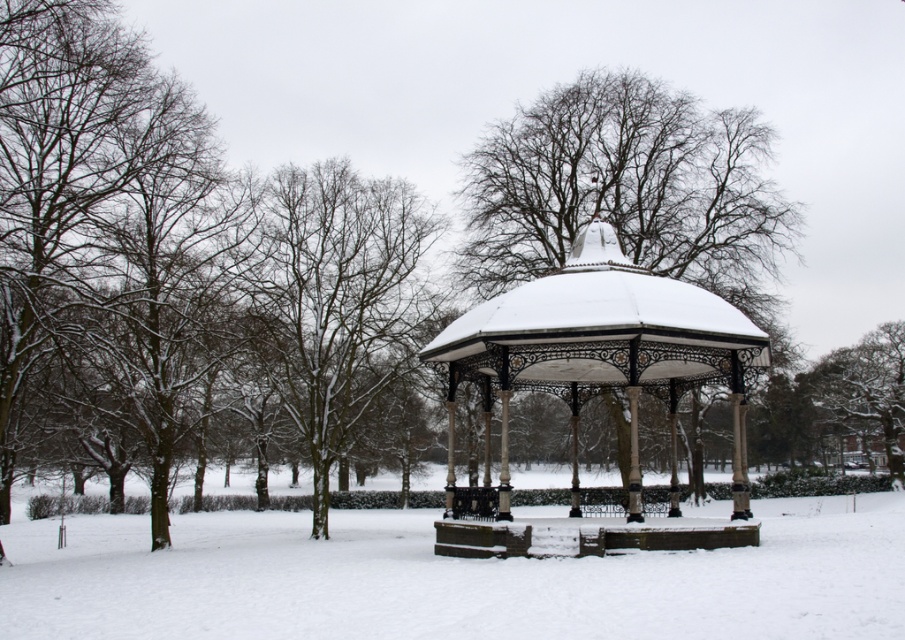
Looking at this image, you are standing at the edge of the park and want to walk directly towards the white powdery snow at center. Which direction should you head?

The white powdery snow at center is located at point (449,579), so you should head towards the center of the image to reach it.